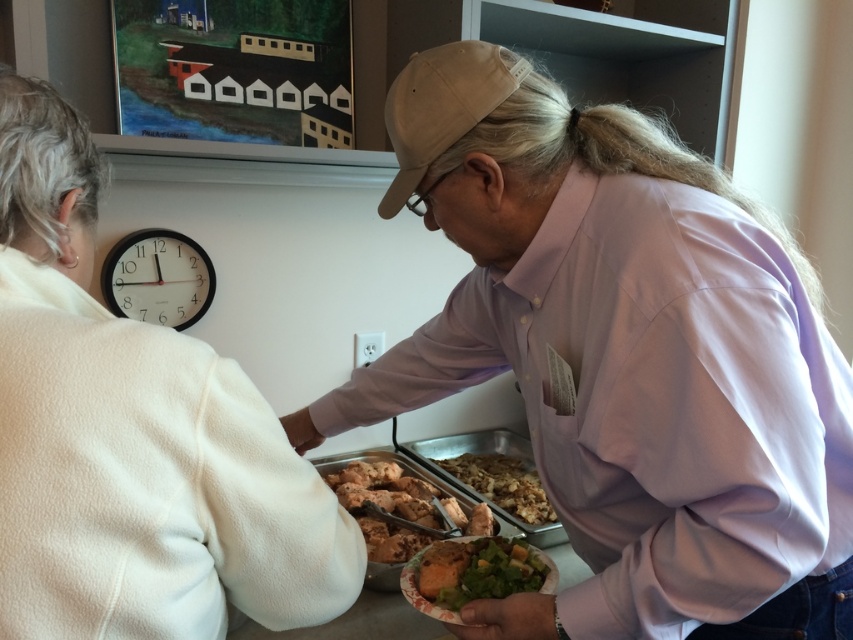
Between point (550, 572) and point (477, 474), which one is positioned in front?

Point (550, 572)

Who is positioned more to the right, golden brown bread at lower center or golden brown mashed potatoes at center?

From the viewer's perspective, golden brown mashed potatoes at center appears more on the right side.

Is point (436, 584) positioned before point (500, 481)?

Yes, point (436, 584) is closer to viewer.

Where is `golden brown bread at lower center`? The width and height of the screenshot is (853, 640). golden brown bread at lower center is located at coordinates (473, 573).

Is point (666, 344) positioned before point (26, 124)?

No, it is not.

Consider the image. Does pink cotton shirt at center come behind white fleece jacket at upper left?

Yes, pink cotton shirt at center is further from the viewer.

Who is more distant from viewer, (635,353) or (64,364)?

Result: The point (635,353) is more distant.

Find the location of a particular element. The image size is (853, 640). pink cotton shirt at center is located at coordinates click(622, 358).

Does point (279, 611) come in front of point (416, 509)?

Yes.

Is white fleece jacket at upper left to the left of brown matte chicken at center from the viewer's perspective?

Indeed, white fleece jacket at upper left is positioned on the left side of brown matte chicken at center.

Between point (316, 508) and point (358, 468), which one is positioned in front?

Positioned in front is point (316, 508).

This screenshot has width=853, height=640. I want to click on white fleece jacket at upper left, so tap(132, 436).